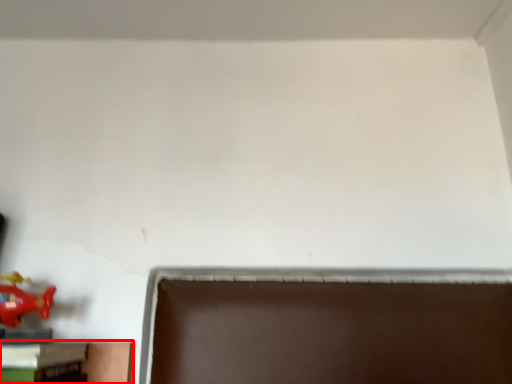
Question: Where is furniture (annotated by the red box) located in relation to toy in the image?

Choices:
 (A) left
 (B) right

Answer: (B)